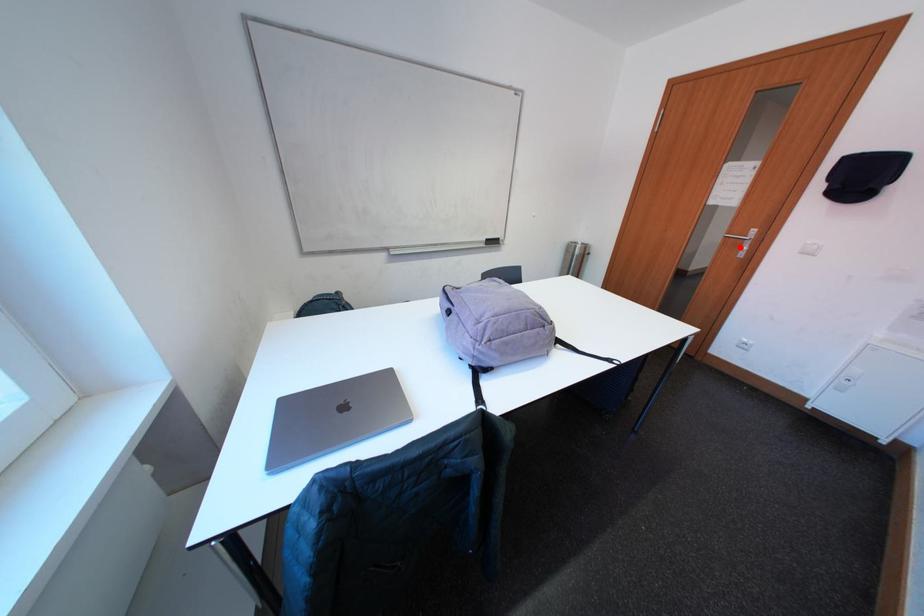
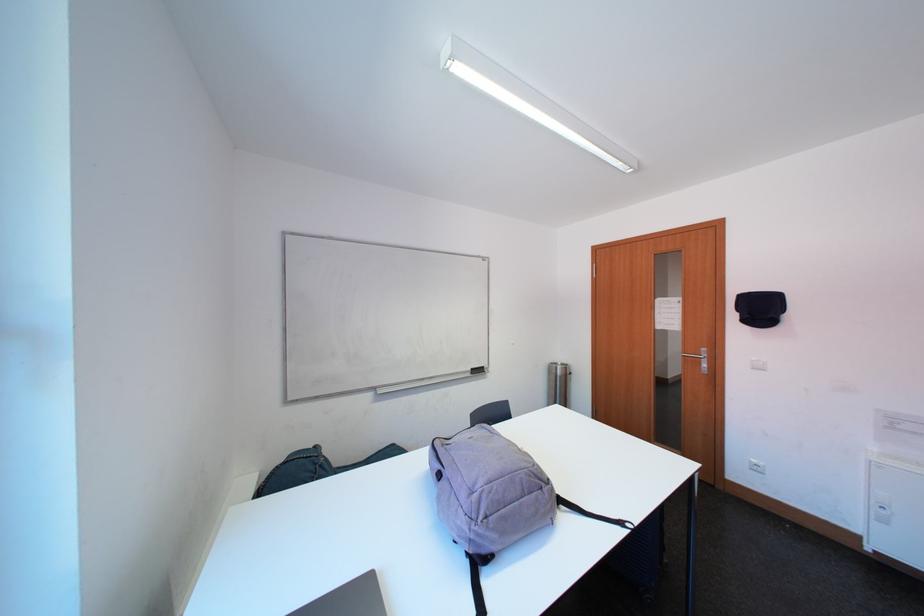
Find the pixel in the second image that matches the highlighted location in the first image.

(699, 365)